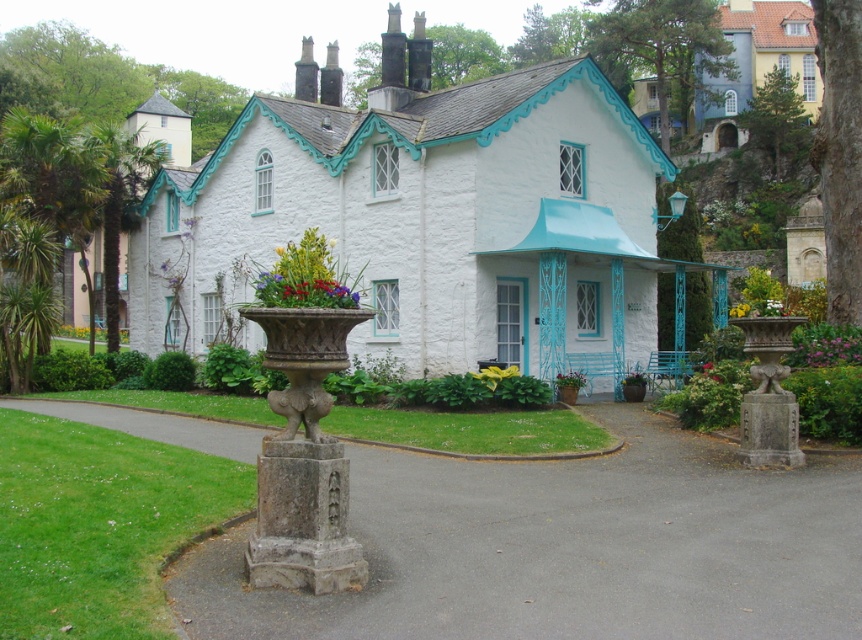
You are standing at the entrance of the white stone cottage with turquoise accents. You need to locate the gray asphalt driveway at lower center. Based on the coordinates provided, where exactly is the driveway positioned in the image?

The gray asphalt driveway at lower center is positioned at coordinates point (567, 547).

Looking at this image, you are a gardener planning to place a new decoration in the garden. You have a vibrant floral bouquet at center and a yellow fabric flower at center. Which one is narrower?

The vibrant floral bouquet at center is narrower than the yellow fabric flower at center.

From the picture: You are standing at the driveway of the white stone cottage and see the vibrant floral bouquet at center and the yellow fabric flower at center. Which one is positioned higher?

The vibrant floral bouquet at center is positioned higher than the yellow fabric flower at center.